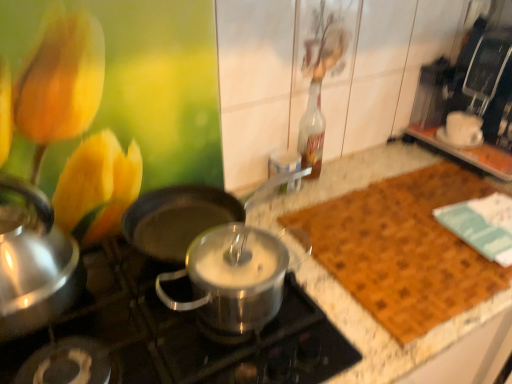
Question: Does brown woven mat at right contain stainless steel pot at center?

Choices:
 (A) no
 (B) yes

Answer: (A)

Question: From the image's perspective, is brown woven mat at right located above stainless steel pot at center?

Choices:
 (A) no
 (B) yes

Answer: (B)

Question: Can you see brown woven mat at right touching stainless steel pot at center?

Choices:
 (A) yes
 (B) no

Answer: (B)

Question: Is brown woven mat at right outside of stainless steel pot at center?

Choices:
 (A) no
 (B) yes

Answer: (B)

Question: Can you confirm if brown woven mat at right is shorter than stainless steel pot at center?

Choices:
 (A) no
 (B) yes

Answer: (B)

Question: Is brown woven mat at right behind stainless steel pot at center?

Choices:
 (A) no
 (B) yes

Answer: (B)

Question: Is translucent glass bottle at center taller than stainless steel pot at center?

Choices:
 (A) no
 (B) yes

Answer: (B)

Question: Is translucent glass bottle at center placed right next to stainless steel pot at center?

Choices:
 (A) no
 (B) yes

Answer: (A)

Question: Does translucent glass bottle at center have a larger size compared to stainless steel pot at center?

Choices:
 (A) yes
 (B) no

Answer: (B)

Question: Is translucent glass bottle at center far away from stainless steel pot at center?

Choices:
 (A) yes
 (B) no

Answer: (B)

Question: Is translucent glass bottle at center at the left side of stainless steel pot at center?

Choices:
 (A) yes
 (B) no

Answer: (B)

Question: Could you tell me if translucent glass bottle at center is turned towards stainless steel pot at center?

Choices:
 (A) no
 (B) yes

Answer: (A)

Question: Considering the relative sizes of stainless steel pot at center and brown woven mat at right in the image provided, is stainless steel pot at center smaller than brown woven mat at right?

Choices:
 (A) no
 (B) yes

Answer: (A)